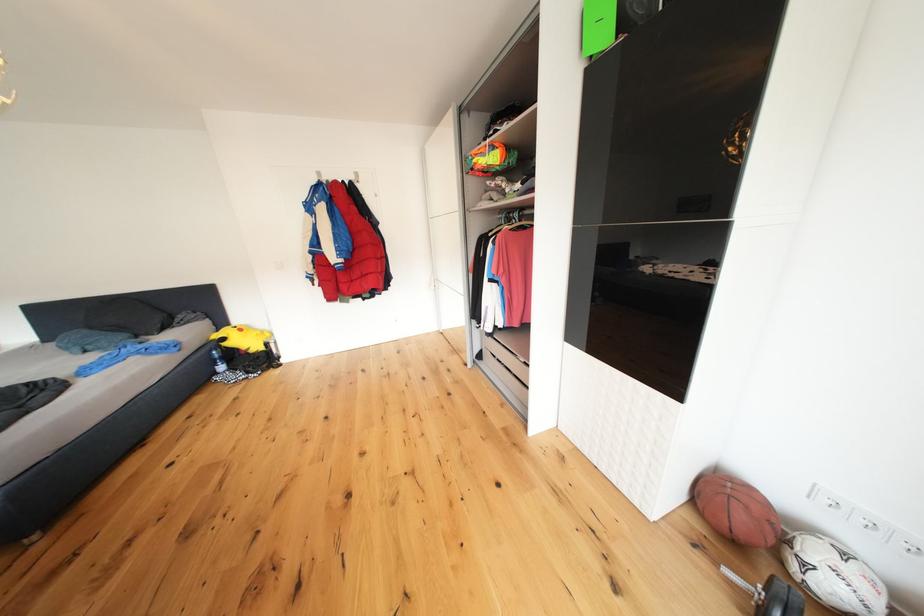
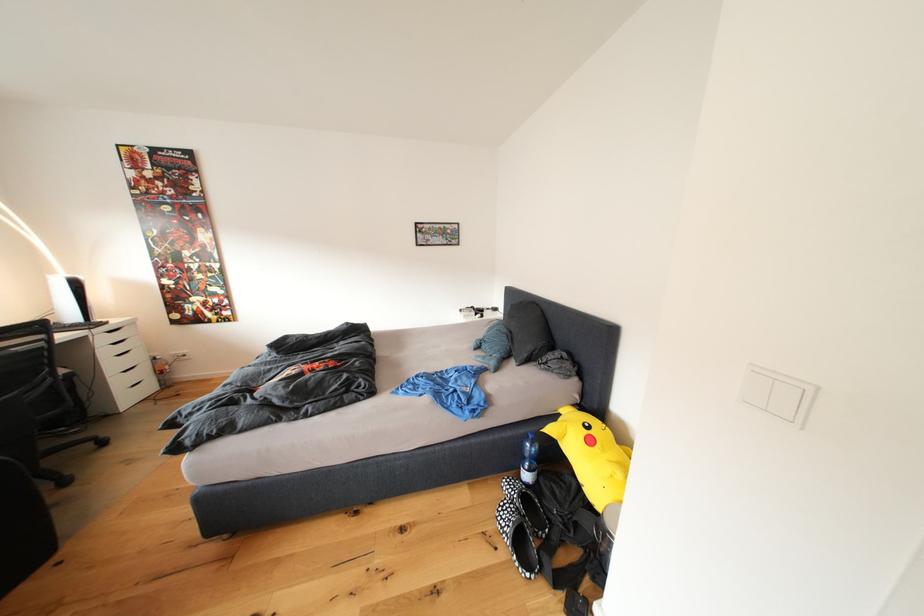
In the second image, find the point that corresponds to pixel 249 334 in the first image.

(600, 446)